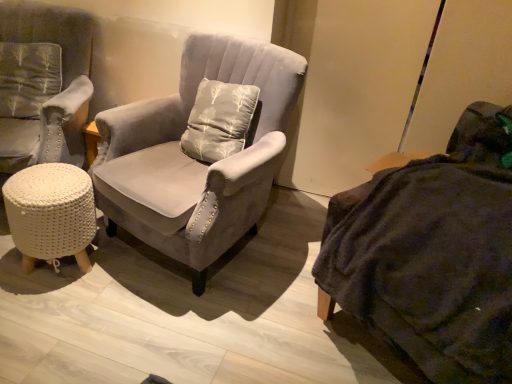
Question: Is suede gray armchair at center, marked as the 2th chair in a left-to-right arrangement, wider than dark gray fabric couch at right?

Choices:
 (A) no
 (B) yes

Answer: (A)

Question: From a real-world perspective, is suede gray armchair at center, the 1th chair viewed from the right, positioned over dark gray fabric couch at right based on gravity?

Choices:
 (A) no
 (B) yes

Answer: (A)

Question: Is suede gray armchair at center, marked as the 2th chair in a left-to-right arrangement, bigger than dark gray fabric couch at right?

Choices:
 (A) yes
 (B) no

Answer: (A)

Question: Does suede gray armchair at center, marked as the 2th chair in a left-to-right arrangement, have a lesser width compared to dark gray fabric couch at right?

Choices:
 (A) no
 (B) yes

Answer: (B)

Question: Is suede gray armchair at center, marked as the 2th chair in a left-to-right arrangement, closer to the viewer compared to dark gray fabric couch at right?

Choices:
 (A) no
 (B) yes

Answer: (A)

Question: Is white knitted stool at lower left spatially inside suede gray armchair at center, the 1th chair viewed from the right, or outside of it?

Choices:
 (A) inside
 (B) outside

Answer: (B)

Question: Is white knitted stool at lower left in front of or behind suede gray armchair at center, marked as the 2th chair in a left-to-right arrangement, in the image?

Choices:
 (A) front
 (B) behind

Answer: (B)

Question: From a real-world perspective, is white knitted stool at lower left above or below suede gray armchair at center, the 1th chair viewed from the right?

Choices:
 (A) above
 (B) below

Answer: (B)

Question: From the image's perspective, is white knitted stool at lower left located above or below suede gray armchair at center, marked as the 2th chair in a left-to-right arrangement?

Choices:
 (A) below
 (B) above

Answer: (A)

Question: Is white knitted stool at lower left wider or thinner than dark gray fabric couch at right?

Choices:
 (A) wide
 (B) thin

Answer: (B)

Question: Considering the positions of white knitted stool at lower left and dark gray fabric couch at right in the image, is white knitted stool at lower left bigger or smaller than dark gray fabric couch at right?

Choices:
 (A) big
 (B) small

Answer: (B)

Question: Do you think white knitted stool at lower left is within dark gray fabric couch at right, or outside of it?

Choices:
 (A) inside
 (B) outside

Answer: (B)

Question: From a real-world perspective, relative to dark gray fabric couch at right, is white knitted stool at lower left vertically above or below?

Choices:
 (A) above
 (B) below

Answer: (B)

Question: From their relative heights in the image, would you say dark gray fabric couch at right is taller or shorter than suede gray armchair at center, the 1th chair viewed from the right?

Choices:
 (A) short
 (B) tall

Answer: (A)

Question: Would you say dark gray fabric couch at right is inside or outside suede gray armchair at center, the 1th chair viewed from the right?

Choices:
 (A) inside
 (B) outside

Answer: (B)